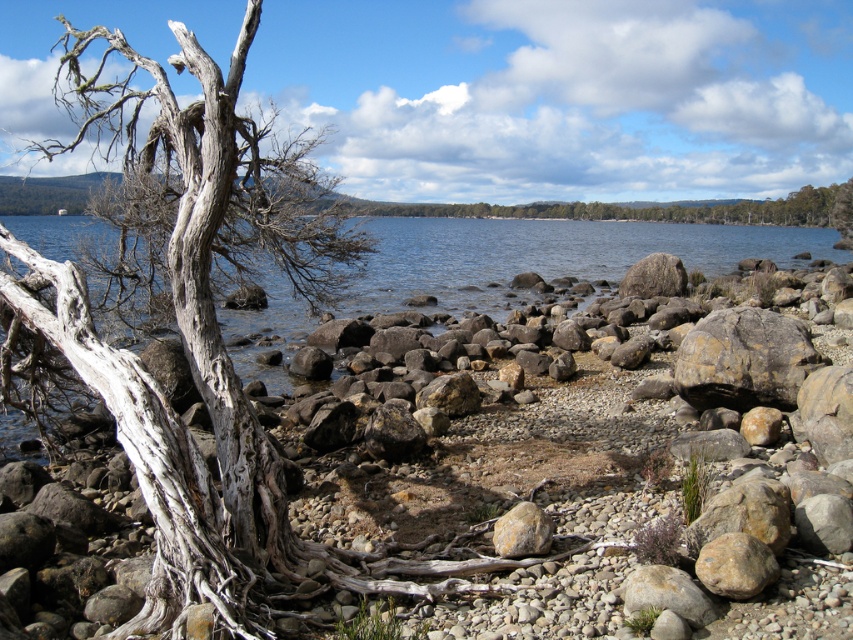
Question: Is white textured driftwood at left wider than rusty metallic rock at lower right?

Choices:
 (A) yes
 (B) no

Answer: (A)

Question: Which of these objects is positioned farthest from the rusty metallic rock at center-right?

Choices:
 (A) clear blue water at center
 (B) yellowish rock at center
 (C) rusty metallic rock at lower right

Answer: (A)

Question: Which of these objects is positioned closest to the white textured driftwood at left?

Choices:
 (A) rusty metallic rock at lower right
 (B) rusty metallic rock at center-right
 (C) gray rough rock at lower right
 (D) smooth bark tree at right

Answer: (C)

Question: Does clear blue water at center appear over gray rough rock at lower right?

Choices:
 (A) no
 (B) yes

Answer: (B)

Question: Does white textured driftwood at left appear over gray rough rock at lower right?

Choices:
 (A) no
 (B) yes

Answer: (B)

Question: Which object is closer to the camera taking this photo?

Choices:
 (A) yellowish rock at center
 (B) rusty metallic rock at lower right

Answer: (B)